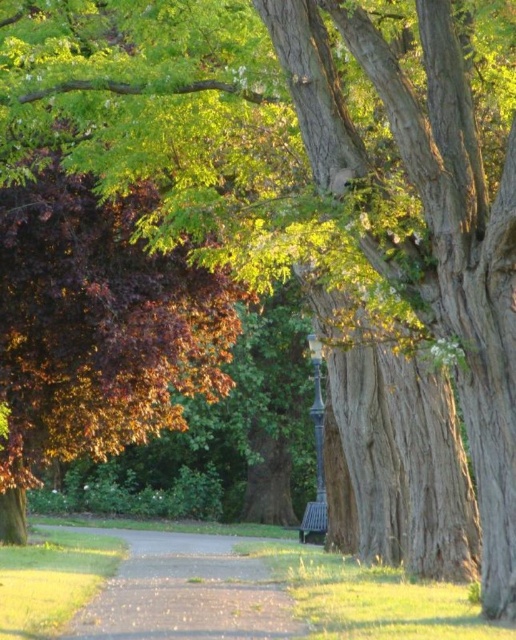
You are standing at the center of the park and want to walk towards the two points marked in the image. Which point, point (227,582) or point (314,540), will you reach first?

Point (227,582) is closer to the viewer than point (314,540), so you will reach point (227,582) first.

You are a gardener who needs to move a heavy wheelbarrow from the gravel path at center to the wooden park bench at lower center. Considering their sizes, will the wheelbarrow fit through the space between them?

The gravel path at center has a larger size compared to wooden park bench at lower center. Since the path is larger, the wheelbarrow should fit through the space between them as long as the bench doesn not block the path.